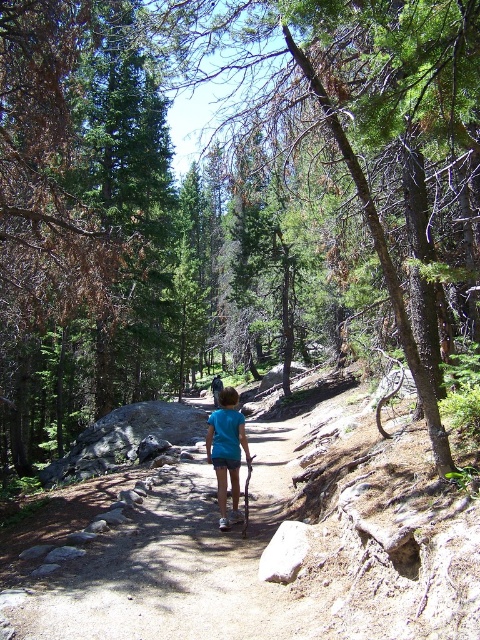
You are a hiker who wants to take a photo of the blue cotton shirt at center. The camera you have can only focus on objects at point (227, 451). Is the blue cotton shirt at center in focus?

The blue cotton shirt at center is located at point (227, 451), so yes, the camera will focus on the blue cotton shirt at center.

You are standing at the camera position and want to reach the point marked at coordinates (228, 444). The path is 1.2 meters wide. If you walk straight towards the point, will you stay on the path?

The point marked at coordinates (228, 444) is 7.10 meters away from the camera. Since the path is 1.2 meters wide, as long as you walk straight towards the point, you will remain on the path because the path width is sufficient to accommodate your movement towards that specific coordinate.

You are a parent looking for your child in the forest. You see two blue shirts at center in the scene. Which one is taller, the blue cotton shirt at center or the blue fabric shirt at center?

The blue cotton shirt at center is taller than the blue fabric shirt at center.